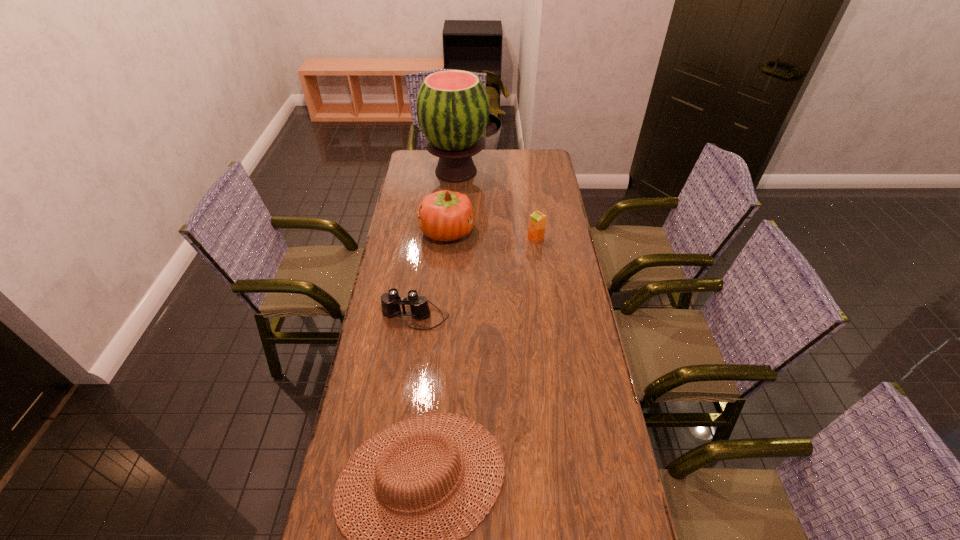
Where is `free area in between the orange juice and the farthest object`? The height and width of the screenshot is (540, 960). free area in between the orange juice and the farthest object is located at coordinates (495, 205).

This screenshot has width=960, height=540. I want to click on empty location between the orange juice and the fourth farthest object, so click(x=475, y=278).

Where is `free spot between the fourth shortest object and the fourth farthest object`? This screenshot has height=540, width=960. free spot between the fourth shortest object and the fourth farthest object is located at coordinates (431, 274).

In order to click on the closest object to the pumpkin in this screenshot , I will do `click(452, 106)`.

Find the location of `the fourth closest object to the pumpkin`. the fourth closest object to the pumpkin is located at coordinates (417, 436).

This screenshot has width=960, height=540. I want to click on vacant region that satisfies the following two spatial constraints: 1. on the back side of the tallest object; 2. on the left side of the fourth farthest object, so 435,171.

At what (x,y) coordinates should I click in order to perform the action: click on free space that satisfies the following two spatial constraints: 1. on the back side of the orange juice; 2. on the side of the pumpkin with the cute face. Please return your answer as a coordinate pair (x, y). Looking at the image, I should click on (535, 232).